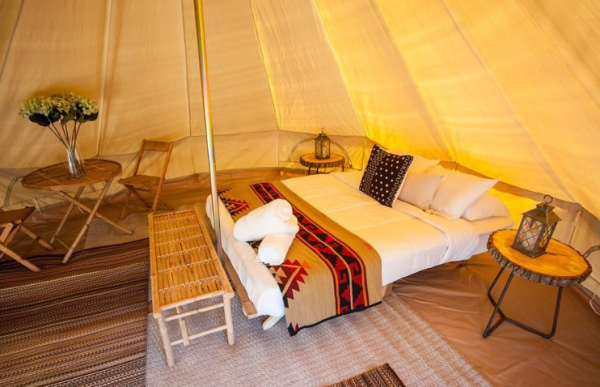
Locate an element on the screen. floor coverings is located at coordinates (482, 342), (346, 352), (98, 362).